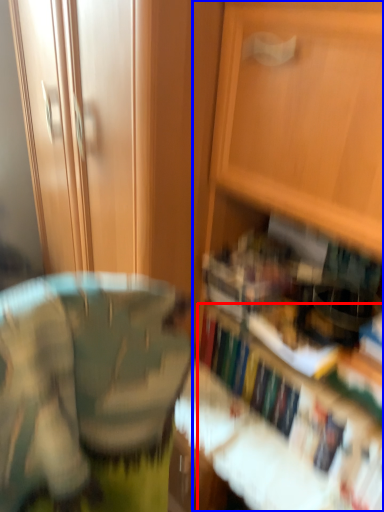
Question: Among these objects, which one is nearest to the camera, book (highlighted by a red box) or cabinetry (highlighted by a blue box)?

Choices:
 (A) book
 (B) cabinetry

Answer: (B)